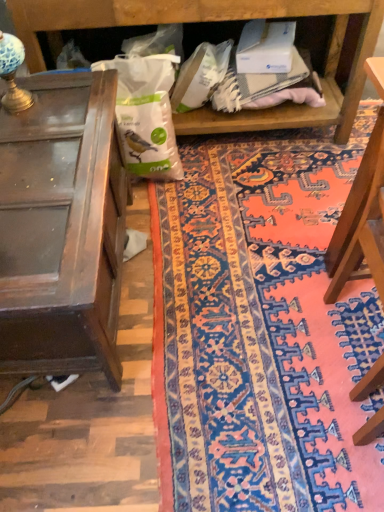
At what (x,y) coordinates should I click in order to perform the action: click on free space in front of wooden table at left. Please return your answer as a coordinate pair (x, y). Looking at the image, I should click on (137, 439).